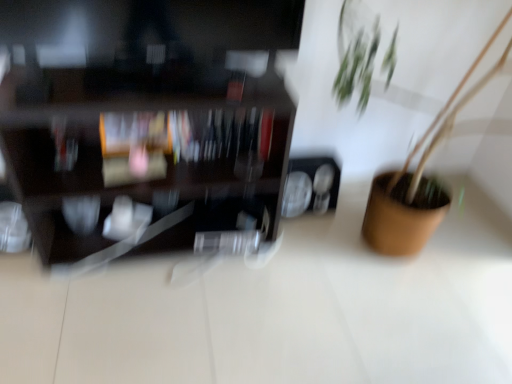
Question: Is brown matte pot at right in front of dark wood shelf at left?

Choices:
 (A) no
 (B) yes

Answer: (B)

Question: Considering the relative positions of brown matte pot at right and dark wood shelf at left in the image provided, is brown matte pot at right to the left of dark wood shelf at left from the viewer's perspective?

Choices:
 (A) no
 (B) yes

Answer: (A)

Question: Would you consider brown matte pot at right to be distant from dark wood shelf at left?

Choices:
 (A) no
 (B) yes

Answer: (A)

Question: Is brown matte pot at right smaller than dark wood shelf at left?

Choices:
 (A) yes
 (B) no

Answer: (B)

Question: Does brown matte pot at right turn towards dark wood shelf at left?

Choices:
 (A) yes
 (B) no

Answer: (B)

Question: Does brown matte pot at right have a greater height compared to dark wood shelf at left?

Choices:
 (A) yes
 (B) no

Answer: (A)

Question: Is dark wood shelf at left at the right side of brown matte pot at right?

Choices:
 (A) yes
 (B) no

Answer: (B)

Question: Is dark wood shelf at left not near brown matte pot at right?

Choices:
 (A) no
 (B) yes

Answer: (A)

Question: Can you confirm if dark wood shelf at left is smaller than brown matte pot at right?

Choices:
 (A) no
 (B) yes

Answer: (B)

Question: Is dark wood shelf at left bigger than brown matte pot at right?

Choices:
 (A) yes
 (B) no

Answer: (B)

Question: Is dark wood shelf at left taller than brown matte pot at right?

Choices:
 (A) yes
 (B) no

Answer: (B)

Question: From the image's perspective, is dark wood shelf at left beneath brown matte pot at right?

Choices:
 (A) no
 (B) yes

Answer: (A)

Question: From the image's perspective, relative to brown matte pot at right, is dark wood shelf at left above or below?

Choices:
 (A) below
 (B) above

Answer: (B)